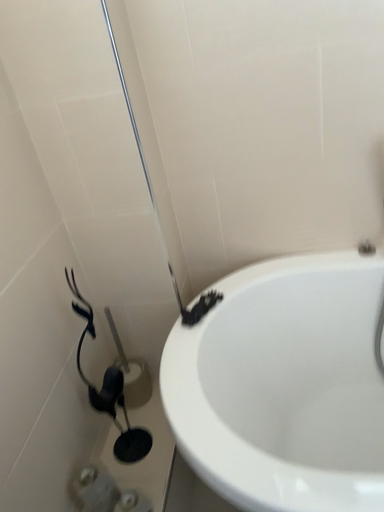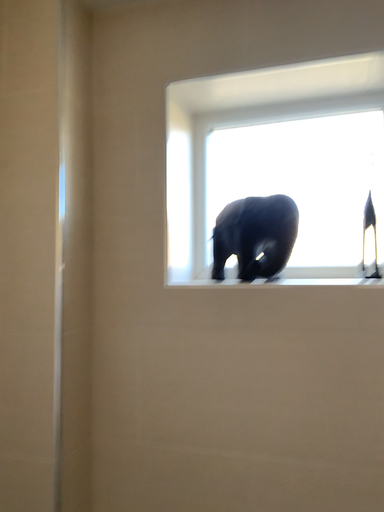
Question: How did the camera likely rotate when shooting the video?

Choices:
 (A) rotated downward
 (B) rotated upward

Answer: (B)